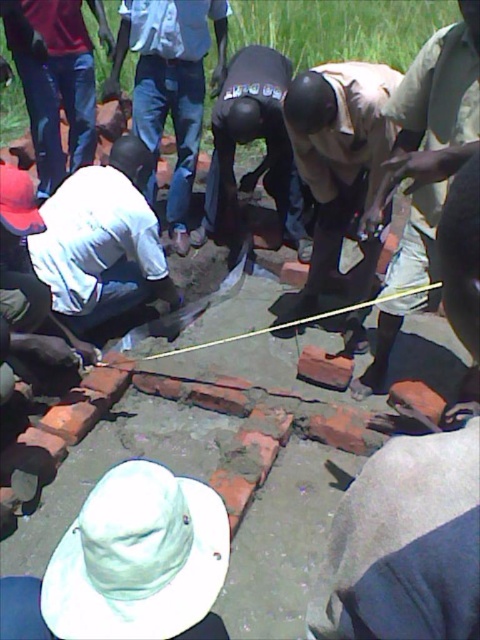
You are a construction worker standing at the edge of the site. You see the brown fabric shirt at center and the denim jeans at upper left. Which clothing item is closer to you?

The brown fabric shirt at center is positioned under denim jeans at upper left, meaning it is closer to you since it is below the jeans in the image.